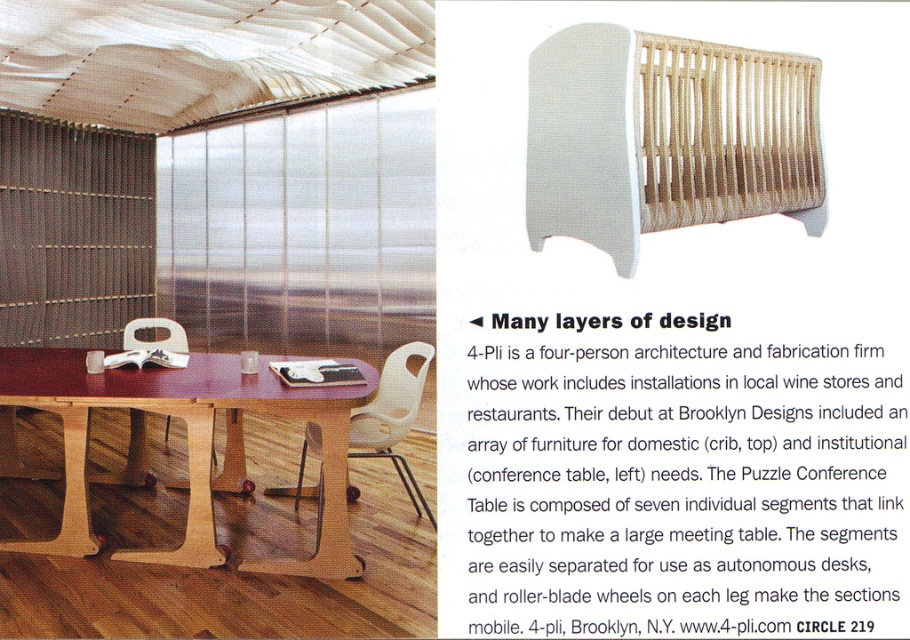
What is the purpose of the point labeled at coordinates (664, 136) in the image?

The point labeled at coordinates (664, 136) marks the location of the natural wood crib at upper right.

You are standing at the center of the room and want to move towards the two points marked in the image. Which point, point (555, 186) or point (134, 557), is closer to you?

Point (555, 186) is in front of point (134, 557), so it is closer to you.

You are standing in the room and want to place a new toy in the exact center of the room. Where should you place it relative to the natural wood crib at upper right?

The natural wood crib at upper right is located at coordinates (664, 136). To place the toy in the exact center of the room, you would need to position it at the midpoint of the room, which is different from the crib location. However, without additional spatial information about the room dimensions or the crib placement relative to the center, it is not possible to determine the exact position relative to the crib.